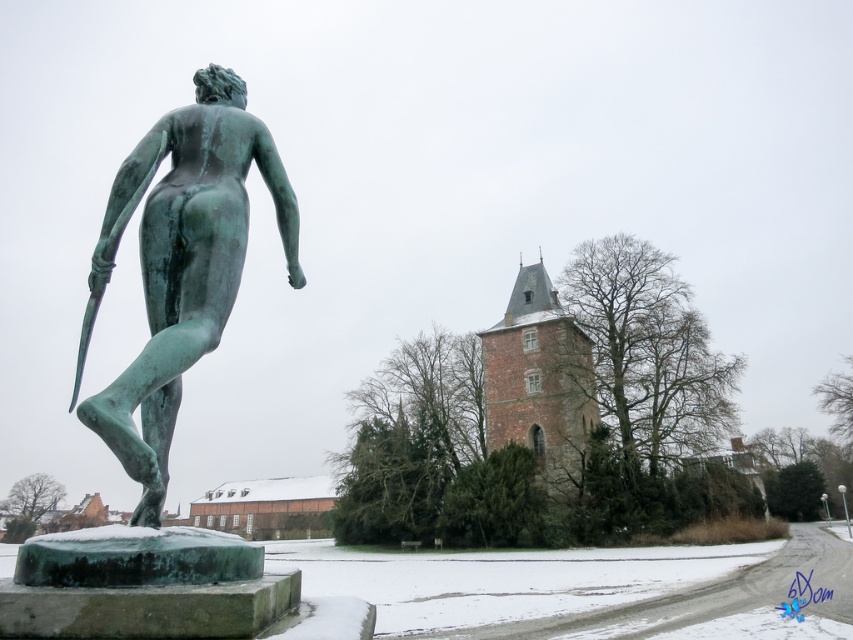
Is green patina bronze statue at left closer to camera compared to brown wooden church at center?

That is True.

Which is in front, point (234, 256) or point (577, 464)?

Point (234, 256) is more forward.

Where is `green patina bronze statue at left`? green patina bronze statue at left is located at coordinates (183, 262).